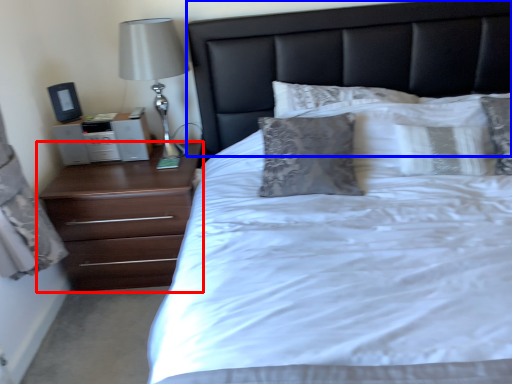
Question: Which point is closer to the camera, chest of drawers (highlighted by a red box) or headboard (highlighted by a blue box)?

Choices:
 (A) chest of drawers
 (B) headboard

Answer: (B)